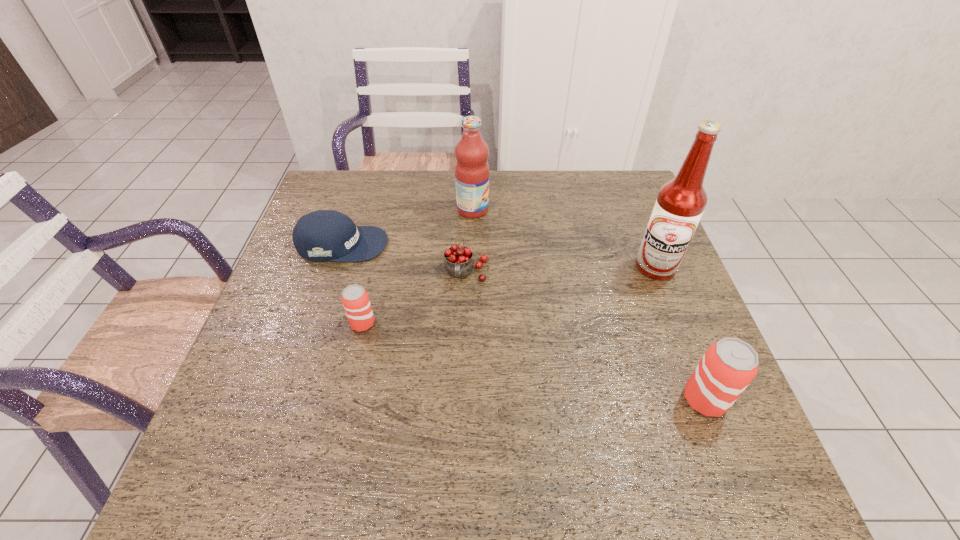
Find the location of a particular element. the second nearest object is located at coordinates (355, 299).

I want to click on the left beer can, so click(355, 299).

Where is `the third tallest object`? the third tallest object is located at coordinates (728, 366).

Locate an element on the screen. This screenshot has width=960, height=540. the nearest object is located at coordinates (728, 366).

Identify the location of the farthest object. This screenshot has height=540, width=960. (471, 170).

The width and height of the screenshot is (960, 540). What are the coordinates of `fruit juice` in the screenshot? It's located at (471, 170).

Locate an element on the screen. This screenshot has width=960, height=540. baseball cap is located at coordinates (324, 235).

The image size is (960, 540). In order to click on the tallest object in this screenshot , I will do `click(680, 203)`.

This screenshot has height=540, width=960. In order to click on cherry in this screenshot , I will do `click(458, 262)`.

Image resolution: width=960 pixels, height=540 pixels. Identify the location of vacant space situated 0.220m on the back of the shorter beer can. (379, 252).